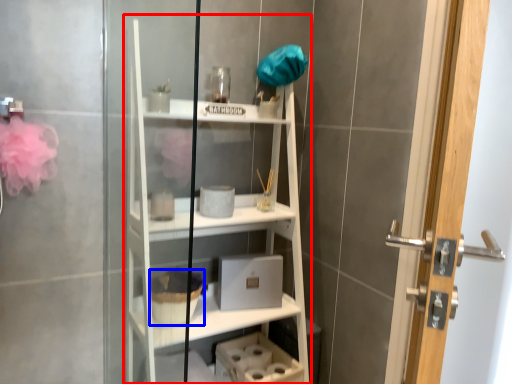
Question: Which point is further to the camera, bookshelf (highlighted by a red box) or basket (highlighted by a blue box)?

Choices:
 (A) bookshelf
 (B) basket

Answer: (B)